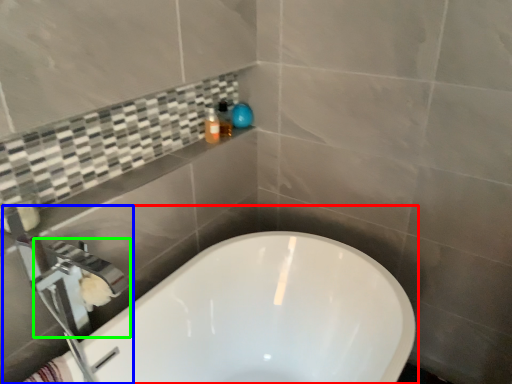
Question: Which is nearer to the bathtub (highlighted by a red box)? tap (highlighted by a blue box) or faucet (highlighted by a green box).

Choices:
 (A) tap
 (B) faucet

Answer: (A)